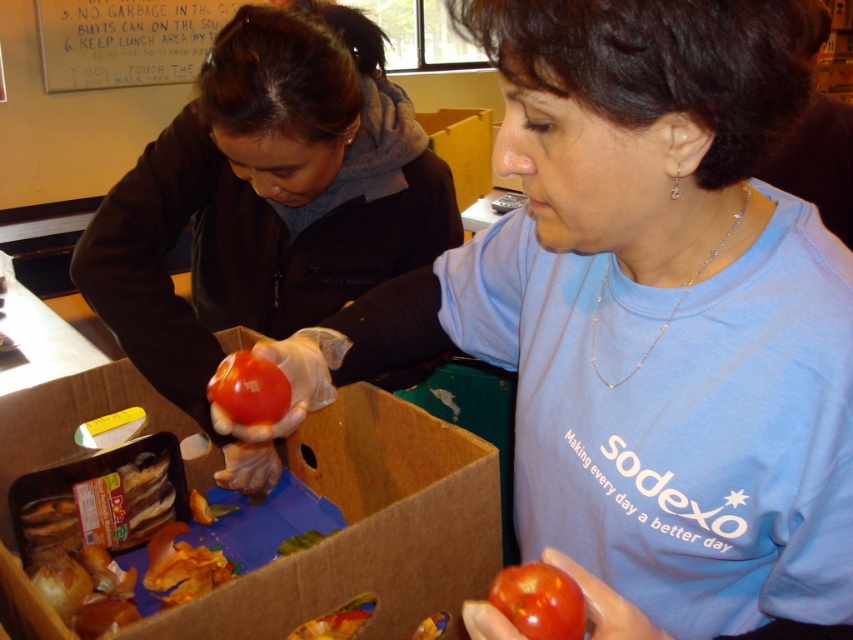
You are a delivery person who needs to place a package on the table. The table has a brown cardboard box at center. Where should you place the package so it doesn not obstruct the work area?

The brown cardboard box at center is located at point (368, 529), so you should place the package away from that coordinate to avoid obstructing the work area.

You are a volunteer at a community kitchen and need to store a 12 inch tall container. The container is too tall for the shelf space available. Looking at the image, which object between the matte black jacket at upper left and the white paperboard at upper left is more likely to be an obstacle in terms of height?

The matte black jacket at upper left is much taller than the white paperboard at upper left, so it is more likely to be an obstacle in terms of height.

Consider the image. You are a food safety inspector and need to check the distance between two points in the image. The points are labeled as point 1 at coordinates point (x=276, y=74) and point 2 at coordinates point (x=128, y=4). According to the image, which point is closer to you?

Point 1 at coordinates point (x=276, y=74) is closer to the viewer than point 2 at coordinates point (x=128, y=4).